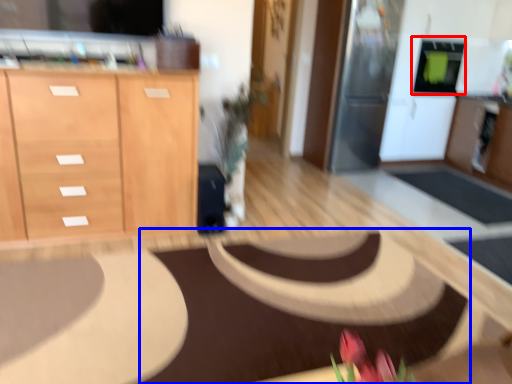
Question: Which object is closer to the camera taking this photo, appliance (highlighted by a red box) or mat (highlighted by a blue box)?

Choices:
 (A) appliance
 (B) mat

Answer: (B)